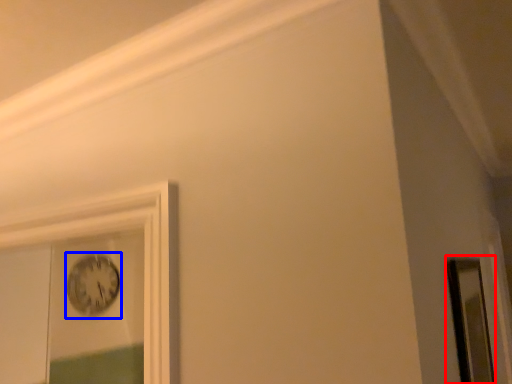
Question: Among these objects, which one is farthest to the camera, mirror (highlighted by a red box) or clock (highlighted by a blue box)?

Choices:
 (A) mirror
 (B) clock

Answer: (B)